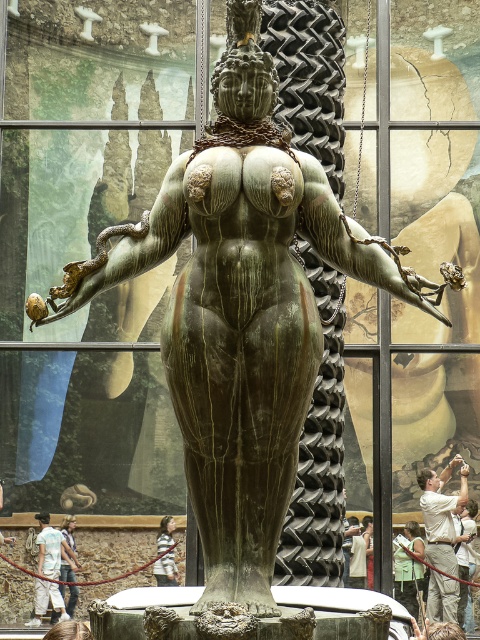
Question: Among these points, which one is farthest from the camera?

Choices:
 (A) (48, 573)
 (B) (168, 552)

Answer: (A)

Question: Among these objects, which one is farthest from the camera?

Choices:
 (A) denim jacket at lower left
 (B) light brown wooden stick at lower center

Answer: (A)

Question: Can you confirm if white cotton shirt at lower right is smaller than light blue denim jeans at lower left?

Choices:
 (A) no
 (B) yes

Answer: (A)

Question: Can you confirm if white cotton shirt at lower right is positioned to the right of light brown wooden stick at lower center?

Choices:
 (A) yes
 (B) no

Answer: (A)

Question: Is white cotton shirt at lower right to the right of denim jacket at lower left from the viewer's perspective?

Choices:
 (A) yes
 (B) no

Answer: (A)

Question: Based on their relative distances, which object is farther from the light brown wooden stick at lower center?

Choices:
 (A) denim jacket at lower left
 (B) white cotton shirt at lower right
 (C) light blue denim jeans at lower left

Answer: (B)